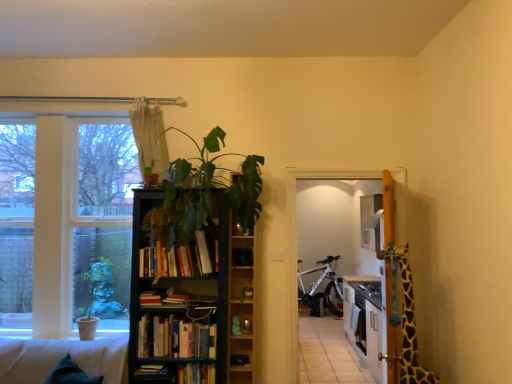
Question: From their relative heights in the image, would you say hardcover book at center, which ranks as the 2th book in bottom-to-top order, is taller or shorter than dark wood bookcase at center?

Choices:
 (A) short
 (B) tall

Answer: (A)

Question: Is hardcover book at center, arranged as the third book when viewed from the top, bigger or smaller than dark wood bookcase at center?

Choices:
 (A) small
 (B) big

Answer: (A)

Question: Considering the real-world distances, which object is closest to the white matte bicycle at center?

Choices:
 (A) green leafy plant at center
 (B) hardcover books at center, the third book when ordered from bottom to top
 (C) hardcover book at center, which is counted as the 4th book, starting from the top
 (D) wooden shelf at center
 (E) white glass window at left

Answer: (D)

Question: Which of these objects is positioned farthest from the white glass window at left?

Choices:
 (A) white matte bicycle at center
 (B) waffle-textured white couch at lower left
 (C) hardcover book at center, which is the 1th book in bottom-to-top order
 (D) hardcover book at center, which ranks as the 2th book in bottom-to-top order
 (E) beige fabric curtain at upper center

Answer: (A)